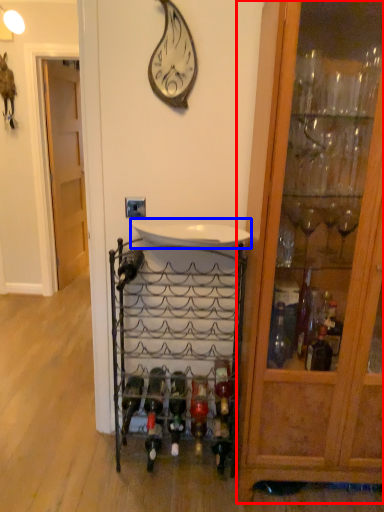
Question: Among these objects, which one is nearest to the camera, cabinetry (highlighted by a red box) or sink (highlighted by a blue box)?

Choices:
 (A) cabinetry
 (B) sink

Answer: (A)